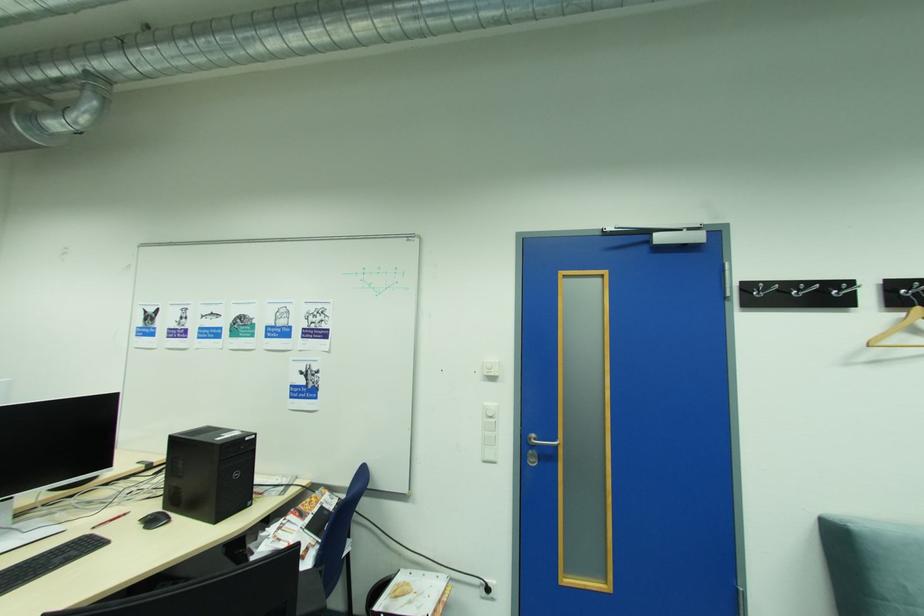
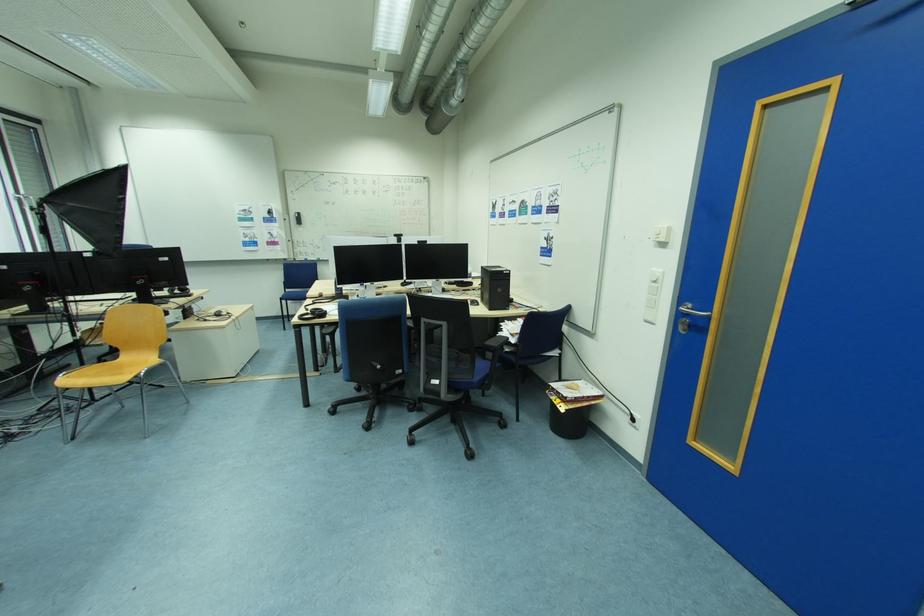
Find the pixel in the second image that matches (542,447) in the first image.

(695, 315)